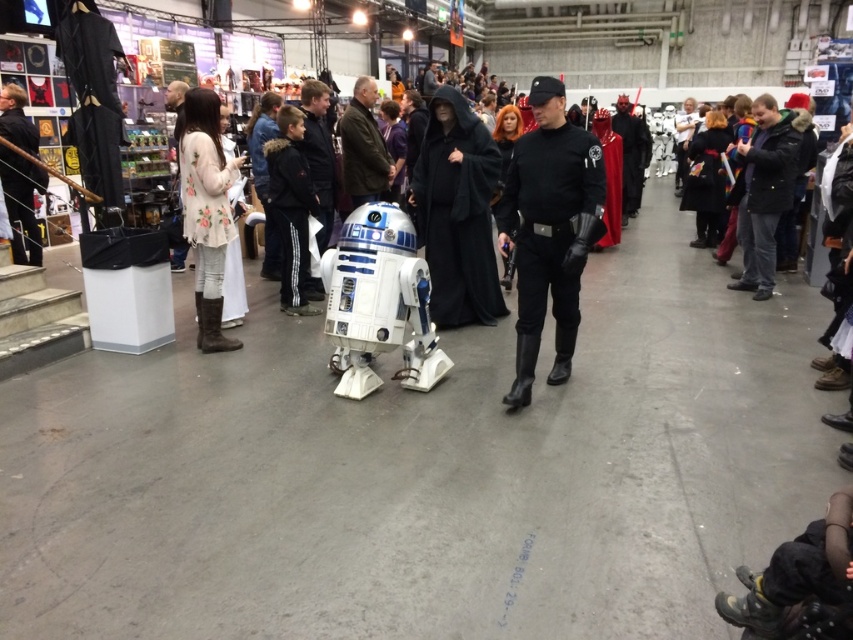
You are a photographer at the convention and want to place a small tripod in the scene. The tripod requires a clear space of 0.3 meters in diameter. Based on the provided coordinates of the black leather jacket at upper right, can you determine if there is enough space near it to place the tripod without overlapping any objects?

The black leather jacket at upper right is located at coordinates point (764, 189). Since there are no other objects mentioned near this location, there might be sufficient space to place the tripod nearby. However, without additional information about nearby objects, it is uncertain if the required 0.3 meters of clear space exists.

You are navigating a crowded convention floor and need to locate the black leather uniform at center. Based on the coordinates provided in the description, can you determine its exact position relative to the edges of the scene?

The black leather uniform at center is located at coordinates point (549, 228), which means it is positioned 35.9 percent from the left edge and 64.5 percent from the top edge of the scene.